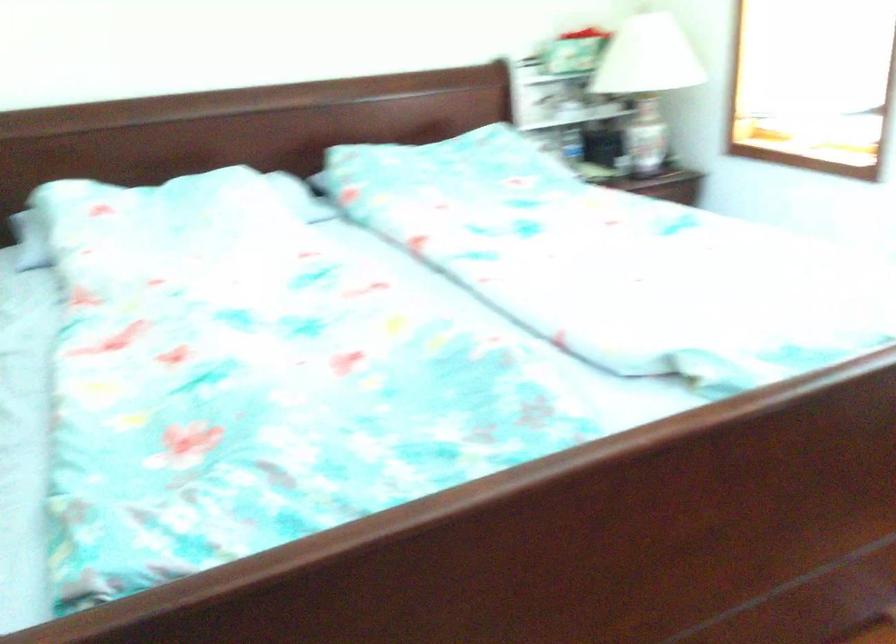
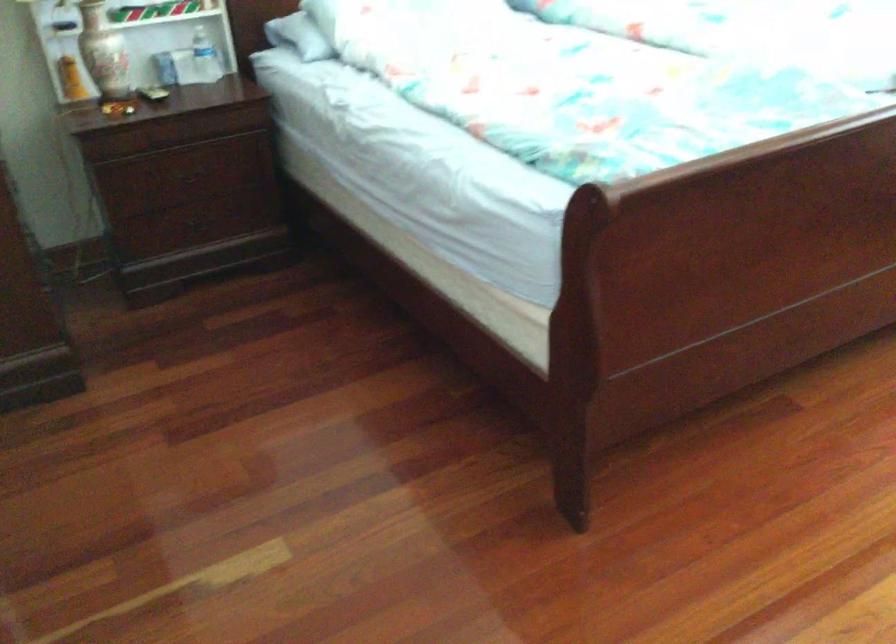
The images are taken continuously from a first-person perspective. In which direction are you moving?

The cameraman moved toward left, backward.